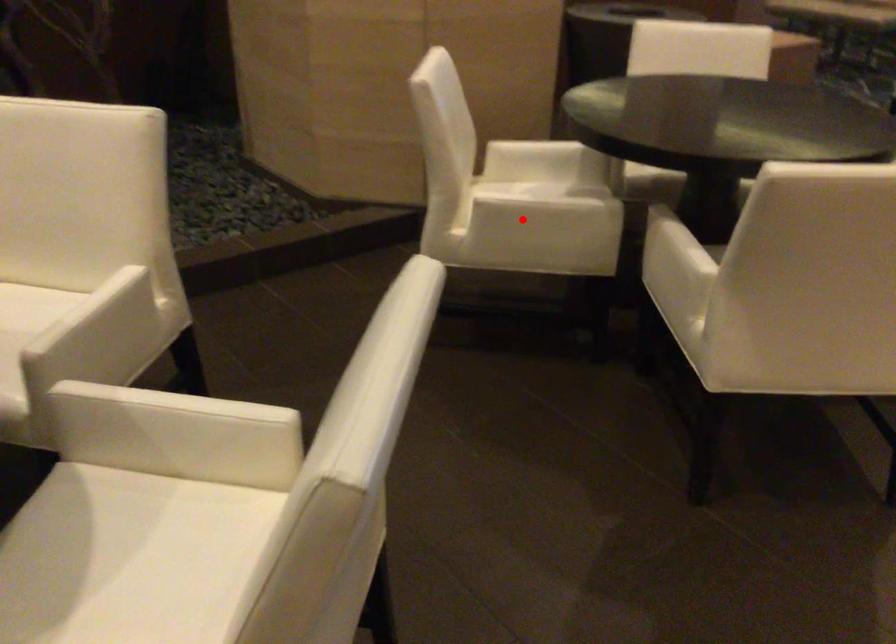
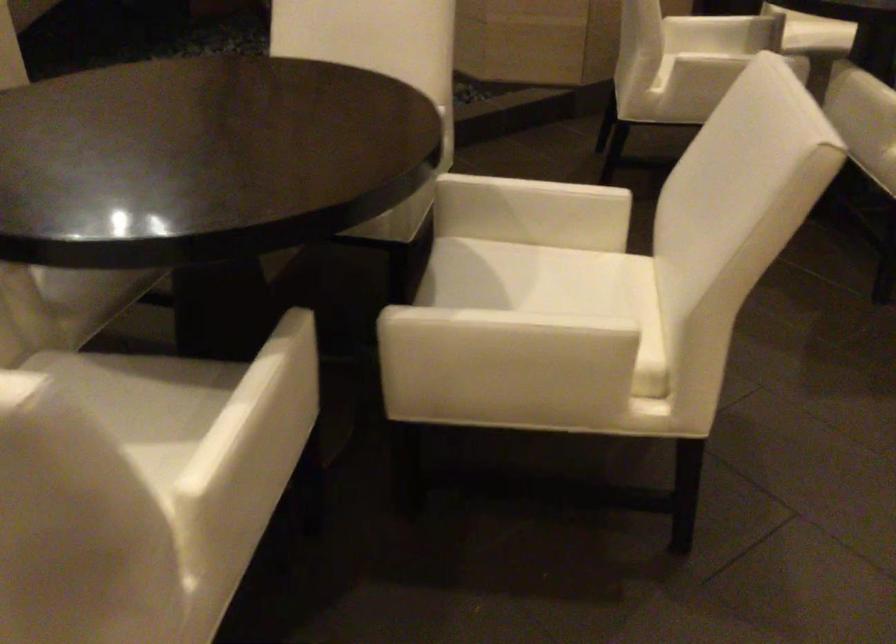
Question: I am providing you with two images of the same scene from different viewpoints. In image1, a red point is highlighted. Considering the same 3D point in image2, which of the following is correct?

Choices:
 (A) It is closer
 (B) It is farther

Answer: (B)